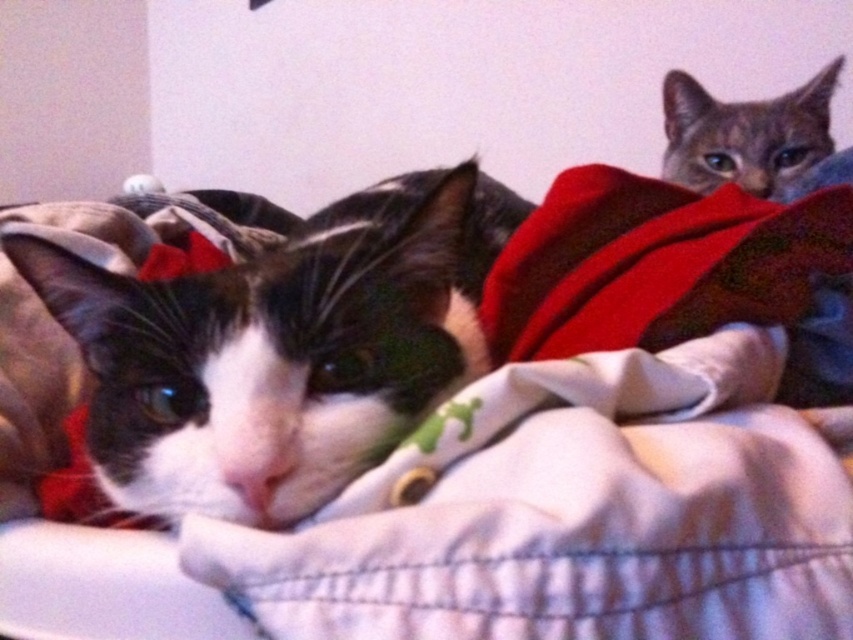
Which is in front, point (192, 348) or point (791, 138)?

Positioned in front is point (192, 348).

Measure the distance from black and white fur cat at left to gray tabby cat at upper right.

black and white fur cat at left and gray tabby cat at upper right are 19.94 inches apart.

Locate an element on the screen. This screenshot has height=640, width=853. black and white fur cat at left is located at coordinates (282, 348).

You are a GUI agent. You are given a task and a screenshot of the screen. Output one action in this format:
    pyautogui.click(x=<x>, y=<y>)
    Task: Click on the black and white fur cat at left
    
    Given the screenshot: What is the action you would take?
    pyautogui.click(x=282, y=348)